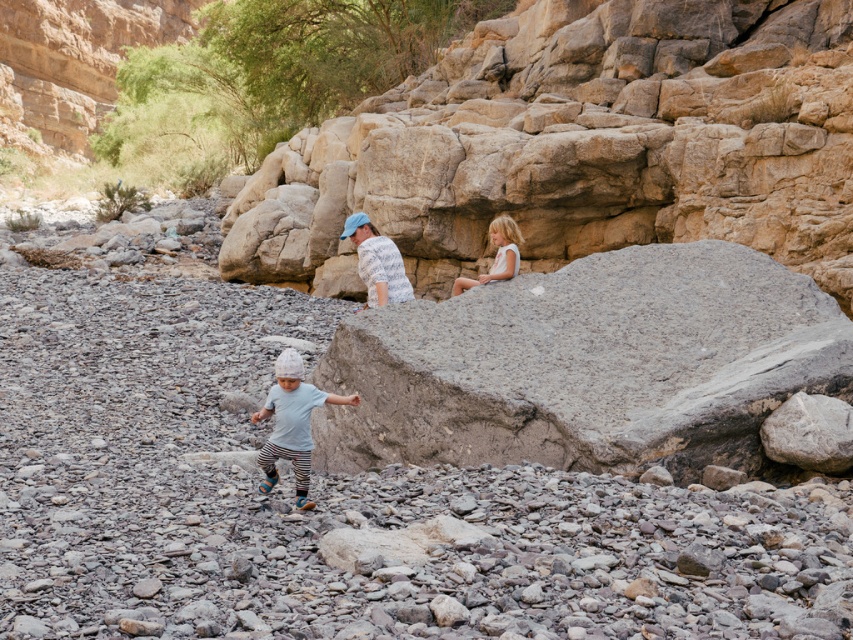
You are a hiker who wants to climb the highest rock in the area. You see the gray rough rock at center and the gray rough boulder at center. Which one should you choose to climb?

The gray rough rock at center is much taller than the gray rough boulder at center, so you should choose to climb the gray rough rock at center.

You are standing at the starting point and see two points in the image. Which point is closer to you, point (437, 250) or point (657, 292)?

Point (437, 250) is closer to you because it is further to the viewer than point (657, 292).